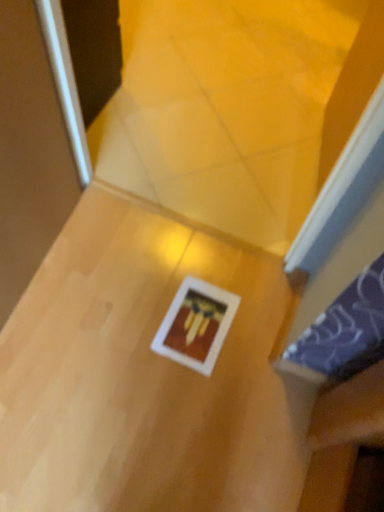
Identify the location of free space above wooden table at center (from a real-world perspective). The height and width of the screenshot is (512, 384). (145, 346).